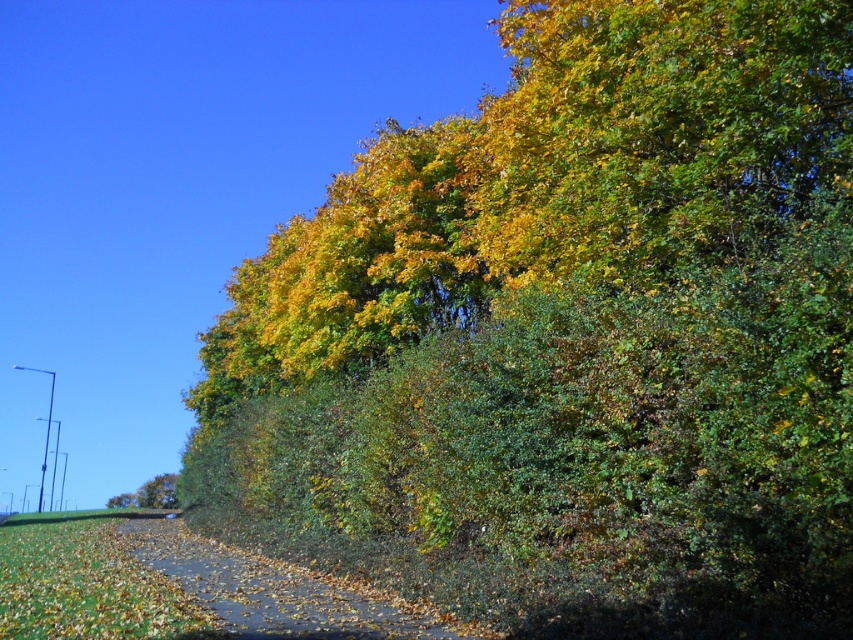
You are planning to walk along the brown leafy path at lower center and pass by the green leafy tree at lower left. Based on their sizes, which one would likely block your view more as you walk?

The brown leafy path at lower center has a larger size compared to the green leafy tree at lower left, so it would likely block your view more as you walk.

You are a hiker carrying a backpack and want to walk along the path. The brown leafy path at lower center and the green leafy tree at lower left are in your way. Which one has a wider width?

The brown leafy path at lower center has a wider width than the green leafy tree at lower left.

You are standing at the starting point of the path in the image. The coordinates of the brown leafy path at lower center are given. If you walk straight ahead along the path, will you eventually reach the grassy area on the left side?

The brown leafy path at lower center is positioned at coordinates point (271, 589). Since the grassy area is on the left side of the image, walking straight along the path may not lead directly to the grassy area unless the path curves toward it. However, based on the provided coordinates alone, it is unclear if the path direction aligns with the grassy area. Further details about the path direction are needed to confirm.